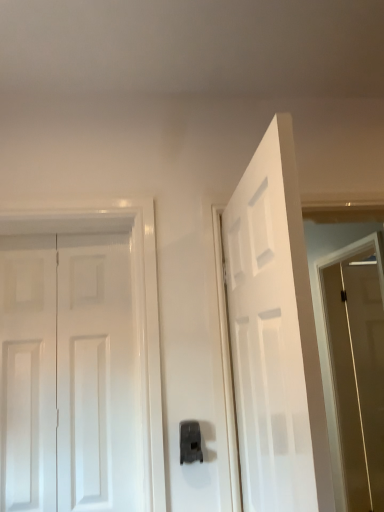
What is the approximate width of white glossy door at left, which ranks as the 2th door in right-to-left order?

The width of white glossy door at left, which ranks as the 2th door in right-to-left order, is 2.06 inches.

The image size is (384, 512). Describe the element at coordinates (190, 441) in the screenshot. I see `black plastic door handle at center` at that location.

The height and width of the screenshot is (512, 384). Identify the location of white glossy door at left, which ranks as the 2th door in right-to-left order. (75, 368).

From the image's perspective, which is below, brown matte screen door at right or white matte door at center, arranged as the 1th door when viewed from the right?

Result: brown matte screen door at right, from the image's perspective.

In terms of width, does brown matte screen door at right look wider or thinner when compared to white matte door at center, the 2th door when ordered from left to right?

brown matte screen door at right is wider than white matte door at center, the 2th door when ordered from left to right.

Are brown matte screen door at right and white matte door at center, the 2th door when ordered from left to right, located far from each other?

That's right, there is a large distance between brown matte screen door at right and white matte door at center, the 2th door when ordered from left to right.

At what (x,y) coordinates should I click in order to perform the action: click on the 2nd door in front of the brown matte screen door at right. Please return your answer as a coordinate pair (x, y). This screenshot has height=512, width=384. Looking at the image, I should click on (273, 333).

Which of these two, white glossy door at left, which ranks as the 2th door in right-to-left order, or white matte door at center, arranged as the 1th door when viewed from the right, stands taller?

white matte door at center, arranged as the 1th door when viewed from the right.

Could you measure the distance between white glossy door at left, which ranks as the 2th door in right-to-left order, and white matte door at center, the 2th door when ordered from left to right?

white glossy door at left, which ranks as the 2th door in right-to-left order, and white matte door at center, the 2th door when ordered from left to right, are 23.63 inches apart.

Are white glossy door at left, arranged as the 1th door when viewed from the left, and white matte door at center, the 2th door when ordered from left to right, far apart?

Actually, white glossy door at left, arranged as the 1th door when viewed from the left, and white matte door at center, the 2th door when ordered from left to right, are a little close together.

From the image's perspective, is white glossy door at left, which ranks as the 2th door in right-to-left order, on white matte door at center, the 2th door when ordered from left to right?

Incorrect, from the image's perspective, white glossy door at left, which ranks as the 2th door in right-to-left order, is lower than white matte door at center, the 2th door when ordered from left to right.

Identify the location of door handle that appears in front of the white glossy door at left, which ranks as the 2th door in right-to-left order. The image size is (384, 512). (190, 441).

Would you say black plastic door handle at center is outside white glossy door at left, which ranks as the 2th door in right-to-left order?

That's correct, black plastic door handle at center is outside of white glossy door at left, which ranks as the 2th door in right-to-left order.

Considering the positions of objects black plastic door handle at center and white glossy door at left, arranged as the 1th door when viewed from the left, in the image provided, who is behind, black plastic door handle at center or white glossy door at left, arranged as the 1th door when viewed from the left,?

white glossy door at left, arranged as the 1th door when viewed from the left, is further away from the camera.

In the scene shown: Is black plastic door handle at center facing towards white glossy door at left, which ranks as the 2th door in right-to-left order?

No.

Based on the photo, which of these two, white glossy door at left, arranged as the 1th door when viewed from the left, or brown matte screen door at right, is bigger?

brown matte screen door at right is bigger.

Would you say white glossy door at left, which ranks as the 2th door in right-to-left order, is inside or outside brown matte screen door at right?

white glossy door at left, which ranks as the 2th door in right-to-left order, cannot be found inside brown matte screen door at right.

Does white glossy door at left, which ranks as the 2th door in right-to-left order, lie in front of brown matte screen door at right?

Yes.

Between white matte door at center, arranged as the 1th door when viewed from the right, and brown matte screen door at right, which one has smaller width?

white matte door at center, arranged as the 1th door when viewed from the right, is thinner.

Can brown matte screen door at right be found inside white matte door at center, arranged as the 1th door when viewed from the right?

No.

Who is shorter, white matte door at center, arranged as the 1th door when viewed from the right, or brown matte screen door at right?

Standing shorter between the two is white matte door at center, arranged as the 1th door when viewed from the right.

Is brown matte screen door at right at the back of white matte door at center, the 2th door when ordered from left to right?

white matte door at center, the 2th door when ordered from left to right, does not have its back to brown matte screen door at right.

Would you say brown matte screen door at right is to the left or to the right of black plastic door handle at center in the picture?

brown matte screen door at right is to the right of black plastic door handle at center.

Based on the photo, in terms of height, does brown matte screen door at right look taller or shorter compared to black plastic door handle at center?

In the image, brown matte screen door at right appears to be taller than black plastic door handle at center.

From the image's perspective, is brown matte screen door at right under black plastic door handle at center?

Yes, from the image's perspective, brown matte screen door at right is beneath black plastic door handle at center.

Which object is more forward, brown matte screen door at right or black plastic door handle at center?

black plastic door handle at center is in front.

Would you say brown matte screen door at right is inside or outside white glossy door at left, which ranks as the 2th door in right-to-left order?

The correct answer is: outside.

Between brown matte screen door at right and white glossy door at left, which ranks as the 2th door in right-to-left order, which one is positioned behind?

brown matte screen door at right is further away from the camera.

From the image's perspective, is brown matte screen door at right positioned above or below white glossy door at left, arranged as the 1th door when viewed from the left?

From the image's perspective, brown matte screen door at right appears below white glossy door at left, arranged as the 1th door when viewed from the left.

Identify the location of screen door behind the white matte door at center, arranged as the 1th door when viewed from the right. (357, 367).

Identify the location of door located above the white glossy door at left, which ranks as the 2th door in right-to-left order (from the image's perspective). (273, 333).

Estimate the real-world distances between objects in this image. Which object is further from black plastic door handle at center, brown matte screen door at right or white glossy door at left, arranged as the 1th door when viewed from the left?

brown matte screen door at right is positioned further to the anchor black plastic door handle at center.

When comparing their distances from brown matte screen door at right, does black plastic door handle at center or white glossy door at left, which ranks as the 2th door in right-to-left order, seem closer?

Based on the image, white glossy door at left, which ranks as the 2th door in right-to-left order, appears to be nearer to brown matte screen door at right.

Based on their spatial positions, is white glossy door at left, arranged as the 1th door when viewed from the left, or brown matte screen door at right further from white matte door at center, the 2th door when ordered from left to right?

brown matte screen door at right is positioned further to the anchor white matte door at center, the 2th door when ordered from left to right.

Looking at the image, which one is located closer to white matte door at center, arranged as the 1th door when viewed from the right, black plastic door handle at center or white glossy door at left, arranged as the 1th door when viewed from the left?

black plastic door handle at center.

From the image, which object appears to be farther from black plastic door handle at center, white matte door at center, arranged as the 1th door when viewed from the right, or white glossy door at left, which ranks as the 2th door in right-to-left order?

white matte door at center, arranged as the 1th door when viewed from the right, lies further to black plastic door handle at center than the other object.

Considering their positions, is brown matte screen door at right positioned closer to white matte door at center, the 2th door when ordered from left to right, than black plastic door handle at center?

black plastic door handle at center.

Considering their positions, is white glossy door at left, arranged as the 1th door when viewed from the left, positioned closer to black plastic door handle at center than brown matte screen door at right?

Among the two, white glossy door at left, arranged as the 1th door when viewed from the left, is located nearer to black plastic door handle at center.

When comparing their distances from white glossy door at left, arranged as the 1th door when viewed from the left, does brown matte screen door at right or white matte door at center, the 2th door when ordered from left to right, seem further?

The object further to white glossy door at left, arranged as the 1th door when viewed from the left, is brown matte screen door at right.

Locate an element on the screen. This screenshot has height=512, width=384. door handle between white matte door at center, the 2th door when ordered from left to right, and brown matte screen door at right, along the z-axis is located at coordinates (190, 441).

I want to click on door between white glossy door at left, arranged as the 1th door when viewed from the left, and brown matte screen door at right from left to right, so click(x=273, y=333).

Where is `door handle located between white glossy door at left, arranged as the 1th door when viewed from the left, and brown matte screen door at right in the left-right direction`? This screenshot has width=384, height=512. door handle located between white glossy door at left, arranged as the 1th door when viewed from the left, and brown matte screen door at right in the left-right direction is located at coordinates (190, 441).

Locate an element on the screen. The width and height of the screenshot is (384, 512). door handle between white matte door at center, arranged as the 1th door when viewed from the right, and white glossy door at left, arranged as the 1th door when viewed from the left, along the z-axis is located at coordinates (190, 441).